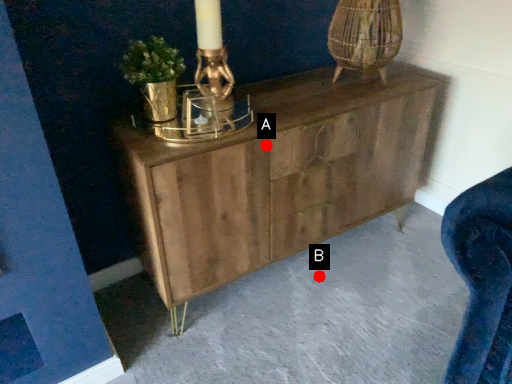
Question: Two points are circled on the image, labeled by A and B beside each circle. Which point is closer to the camera taking this photo?

Choices:
 (A) A is closer
 (B) B is closer

Answer: (A)